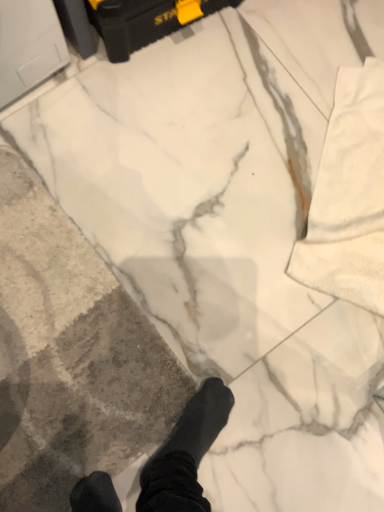
Question: Is black plastic toolbox at upper center taller or shorter than gray textured concrete at center?

Choices:
 (A) short
 (B) tall

Answer: (B)

Question: From a real-world perspective, is black plastic toolbox at upper center above or below gray textured concrete at center?

Choices:
 (A) below
 (B) above

Answer: (B)

Question: Based on their sizes in the image, would you say black plastic toolbox at upper center is bigger or smaller than gray textured concrete at center?

Choices:
 (A) big
 (B) small

Answer: (A)

Question: From the image's perspective, is gray textured concrete at center located above or below black plastic toolbox at upper center?

Choices:
 (A) below
 (B) above

Answer: (A)

Question: Considering the positions of gray textured concrete at center and black plastic toolbox at upper center in the image, is gray textured concrete at center bigger or smaller than black plastic toolbox at upper center?

Choices:
 (A) big
 (B) small

Answer: (B)

Question: Does point (91, 286) appear closer or farther from the camera than point (139, 28)?

Choices:
 (A) closer
 (B) farther

Answer: (A)

Question: Considering the relative positions of gray textured concrete at center and black plastic toolbox at upper center in the image provided, is gray textured concrete at center to the left or to the right of black plastic toolbox at upper center?

Choices:
 (A) right
 (B) left

Answer: (B)